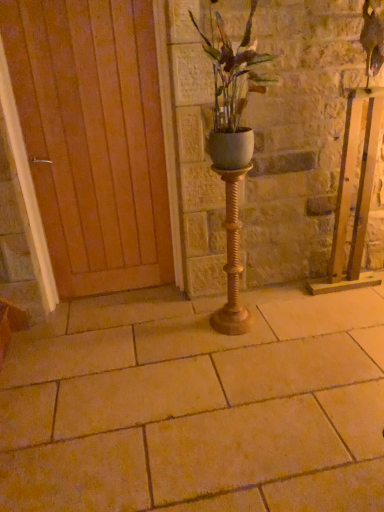
Find the location of a particular element. This screenshot has height=512, width=384. vacant space to the right of gold textured candle holder at center is located at coordinates (268, 323).